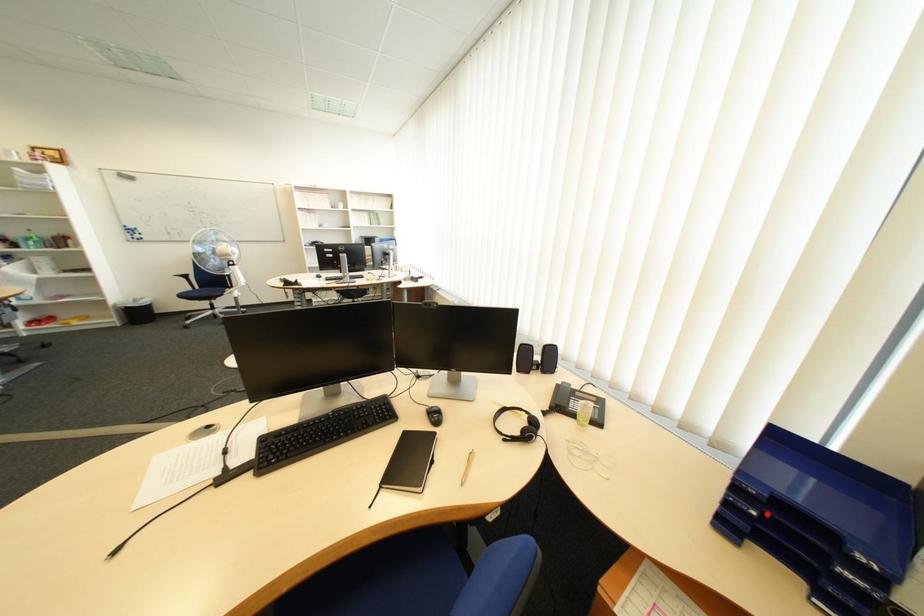
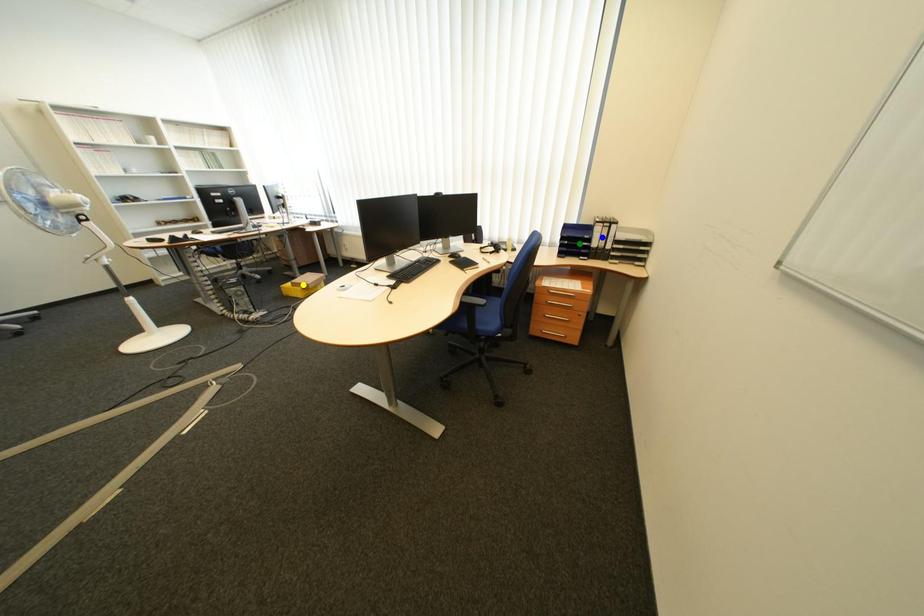
Question: I am providing you with two images of the same scene from different viewpoints. A red point is marked on the first image. You are given multiple points on the second image. In image 2, which mark is for the same physical point as the one in image 1?

Choices:
 (A) green point
 (B) yellow point
 (C) blue point

Answer: (A)